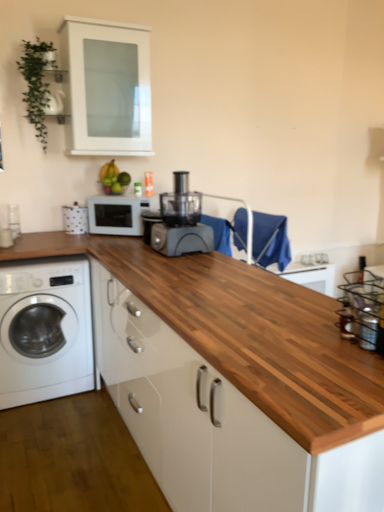
Question: Is matte black food processor at center bigger or smaller than wooden at center?

Choices:
 (A) small
 (B) big

Answer: (A)

Question: Relative to wooden at center, is matte black food processor at center in front or behind?

Choices:
 (A) behind
 (B) front

Answer: (A)

Question: Considering the real-world distances, which object is closest to the white matte cabinet at upper center?

Choices:
 (A) white matte microwave at center
 (B) green matte bananas at upper center
 (C) wooden at center
 (D) white glossy washing machine at lower left
 (E) clear glass bottle at right

Answer: (B)

Question: Based on their relative distances, which object is nearer to the white glossy washing machine at lower left?

Choices:
 (A) clear glass bottle at right
 (B) white matte cabinet at upper center
 (C) white matte microwave at center
 (D) matte black food processor at center
 (E) wooden at center

Answer: (C)